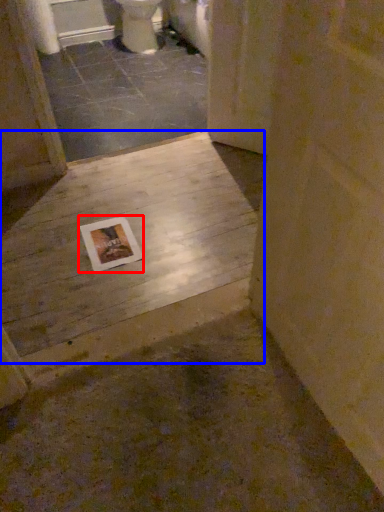
Question: Which of the following is the closest to the observer, postcard (highlighted by a red box) or concrete (highlighted by a blue box)?

Choices:
 (A) postcard
 (B) concrete

Answer: (B)